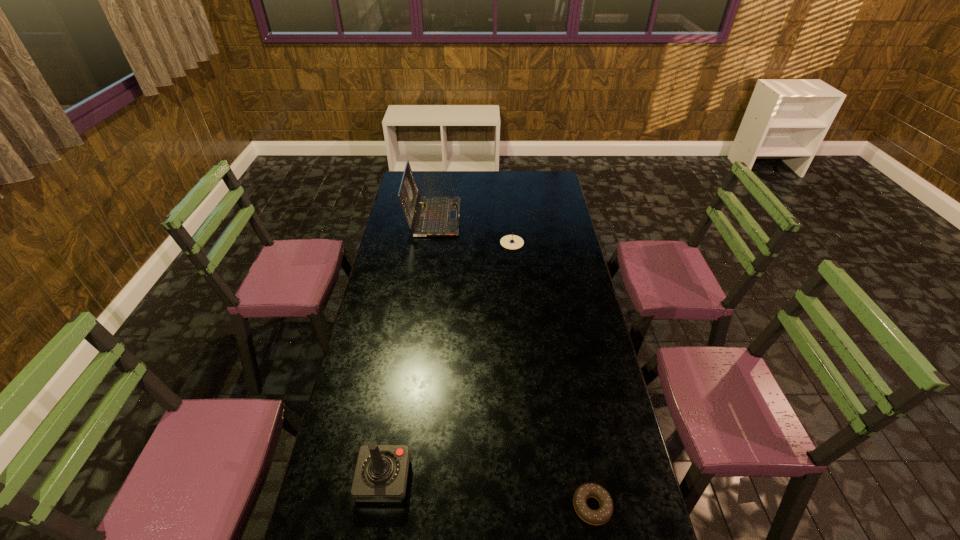
This screenshot has width=960, height=540. In order to click on free space that is in between the shortest object and the joystick in this screenshot , I will do `click(488, 493)`.

The height and width of the screenshot is (540, 960). What are the coordinates of `vacant region between the doughnut and the third tallest object` in the screenshot? It's located at (552, 375).

Find the location of a particular element. This screenshot has height=540, width=960. unoccupied area between the third tallest object and the doughnut is located at coordinates (552, 375).

At what (x,y) coordinates should I click in order to perform the action: click on unoccupied position between the third tallest object and the rightmost object. Please return your answer as a coordinate pair (x, y). The height and width of the screenshot is (540, 960). Looking at the image, I should click on (552, 375).

This screenshot has width=960, height=540. I want to click on empty location between the rightmost object and the second shortest object, so 552,375.

Find the location of `blank region between the joystick and the laptop computer`. blank region between the joystick and the laptop computer is located at coordinates (409, 348).

Select which object appears as the third closest to the second shortest object. Please provide its 2D coordinates. Your answer should be formatted as a tuple, i.e. [(x, y)], where the tuple contains the x and y coordinates of a point satisfying the conditions above.

[(600, 516)]

Locate which object ranks third in proximity to the compass. Please provide its 2D coordinates. Your answer should be formatted as a tuple, i.e. [(x, y)], where the tuple contains the x and y coordinates of a point satisfying the conditions above.

[(600, 516)]

Where is `vacant space that satisfies the following two spatial constraints: 1. on the screen of the laptop computer; 2. on the right side of the third tallest object`? The height and width of the screenshot is (540, 960). vacant space that satisfies the following two spatial constraints: 1. on the screen of the laptop computer; 2. on the right side of the third tallest object is located at coordinates (430, 242).

You are a GUI agent. You are given a task and a screenshot of the screen. Output one action in this format:
    pyautogui.click(x=<x>, y=<y>)
    Task: Click on the vacant space that satisfies the following two spatial constraints: 1. on the screen of the shortest object; 2. on the left side of the laptop computer
    The width and height of the screenshot is (960, 540).
    Given the screenshot: What is the action you would take?
    pyautogui.click(x=395, y=507)